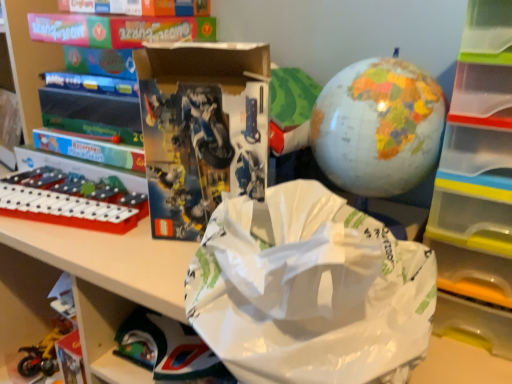
Question: Considering the positions of transparent plastic drawer at right and matte black lego set at center in the image, is transparent plastic drawer at right bigger or smaller than matte black lego set at center?

Choices:
 (A) big
 (B) small

Answer: (A)

Question: From the image's perspective, is transparent plastic drawer at right located above or below matte black lego set at center?

Choices:
 (A) above
 (B) below

Answer: (B)

Question: Which object is positioned closest to the white plastic tray at left, acting as the second toy starting from the bottom?

Choices:
 (A) matte plastic globe at upper right, marked as the 3th toy in a left-to-right arrangement
 (B) transparent plastic drawer at right
 (C) white paper grocery bag at center
 (D) metallic yellow motorcycle at lower left, arranged as the third toy when viewed from the front
 (E) matte black lego set at center

Answer: (E)

Question: Estimate the real-world distances between objects in this image. Which object is farther from the matte plastic globe at upper right, which ranks as the 1th toy in top-to-bottom order?

Choices:
 (A) transparent plastic drawer at right
 (B) white paper grocery bag at center
 (C) matte black lego set at center
 (D) metallic yellow motorcycle at lower left, the 1th toy when ordered from back to front
 (E) white plastic tray at left, which is the second toy in top-to-bottom order

Answer: (D)